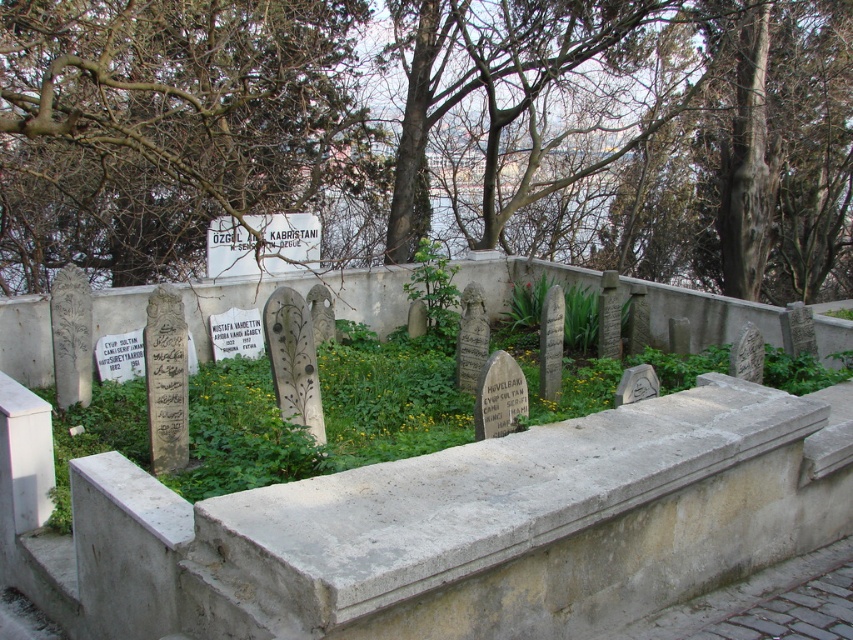
Can you confirm if bare branches at upper center is shorter than green leafy plant at center?

Incorrect, bare branches at upper center's height does not fall short of green leafy plant at center's.

You are a GUI agent. You are given a task and a screenshot of the screen. Output one action in this format:
    pyautogui.click(x=<x>, y=<y>)
    Task: Click on the bare branches at upper center
    
    Given the screenshot: What is the action you would take?
    pyautogui.click(x=166, y=125)

I want to click on bare branches at upper center, so click(x=166, y=125).

Can you confirm if brown leafless tree at upper center is positioned to the left of bare branches at upper center?

No, brown leafless tree at upper center is not to the left of bare branches at upper center.

What do you see at coordinates (434, 134) in the screenshot? I see `brown leafless tree at upper center` at bounding box center [434, 134].

In order to click on brown leafless tree at upper center in this screenshot , I will do `click(434, 134)`.

Between point (514, 150) and point (415, 282), which one is positioned behind?

Positioned behind is point (514, 150).

Image resolution: width=853 pixels, height=640 pixels. I want to click on brown leafless tree at upper center, so click(434, 134).